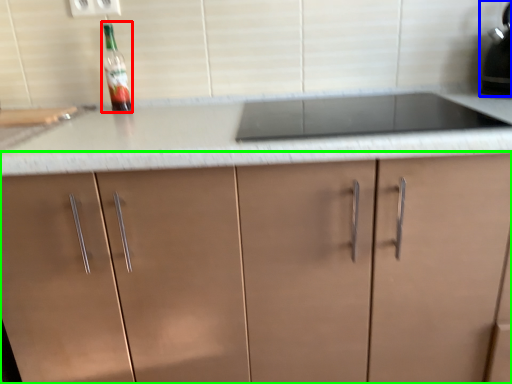
Question: Based on their relative distances, which object is farther from bottle (highlighted by a red box)? Choose from kitchen appliance (highlighted by a blue box) and cabinetry (highlighted by a green box).

Choices:
 (A) kitchen appliance
 (B) cabinetry

Answer: (A)